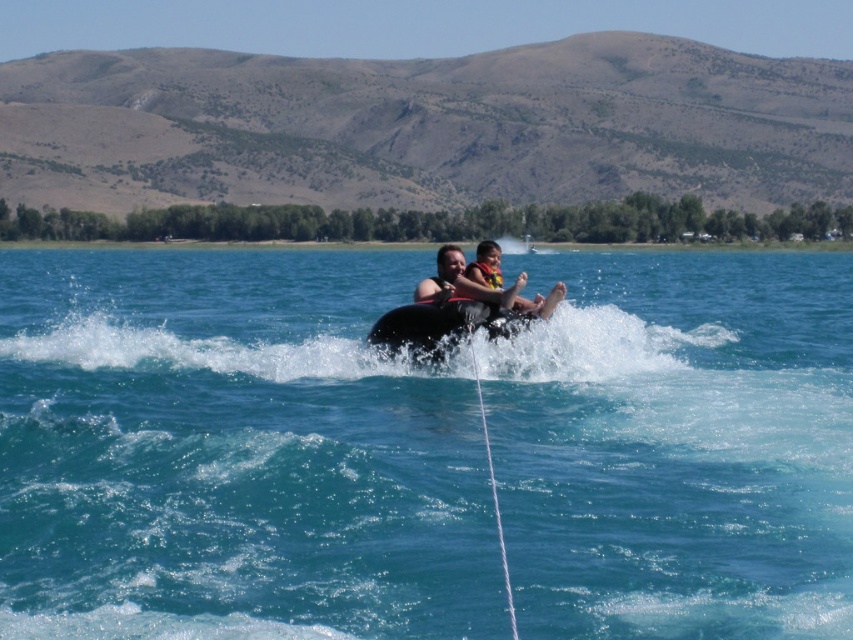
Based on the photo, between clear blue water at center and matte black life vest at center, which one appears on the left side from the viewer's perspective?

Positioned to the left is clear blue water at center.

I want to click on clear blue water at center, so click(233, 451).

Between point (543, 314) and point (492, 273), which one is positioned behind?

Point (492, 273)

Can you confirm if matte black life vest at center is positioned to the left of yellow fabric life jacket at center?

No, matte black life vest at center is not to the left of yellow fabric life jacket at center.

Describe the element at coordinates (485, 264) in the screenshot. I see `matte black life vest at center` at that location.

Locate an element on the screen. The height and width of the screenshot is (640, 853). matte black life vest at center is located at coordinates (485, 264).

Is clear blue water at center above yellow fabric life jacket at center?

Correct, clear blue water at center is located above yellow fabric life jacket at center.

Can you confirm if clear blue water at center is smaller than yellow fabric life jacket at center?

Actually, clear blue water at center might be larger than yellow fabric life jacket at center.

Between point (614, 525) and point (491, 275), which one is positioned in front?

Point (614, 525) is in front.

Find the location of a particular element. clear blue water at center is located at coordinates (233, 451).